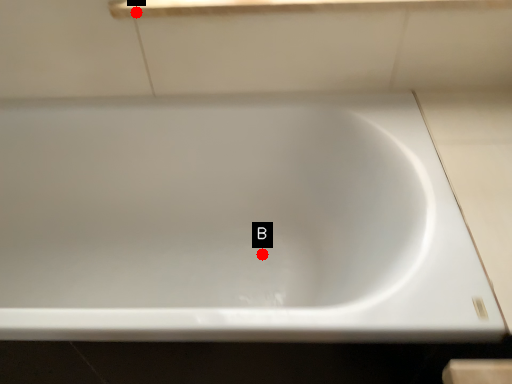
Question: Two points are circled on the image, labeled by A and B beside each circle. Which point is farther to the camera?

Choices:
 (A) A is further
 (B) B is further

Answer: (B)